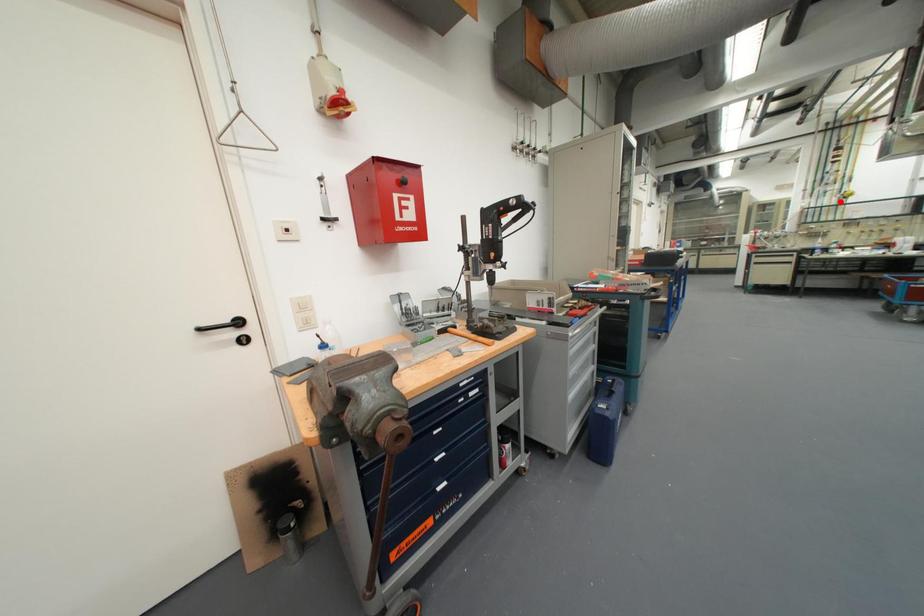
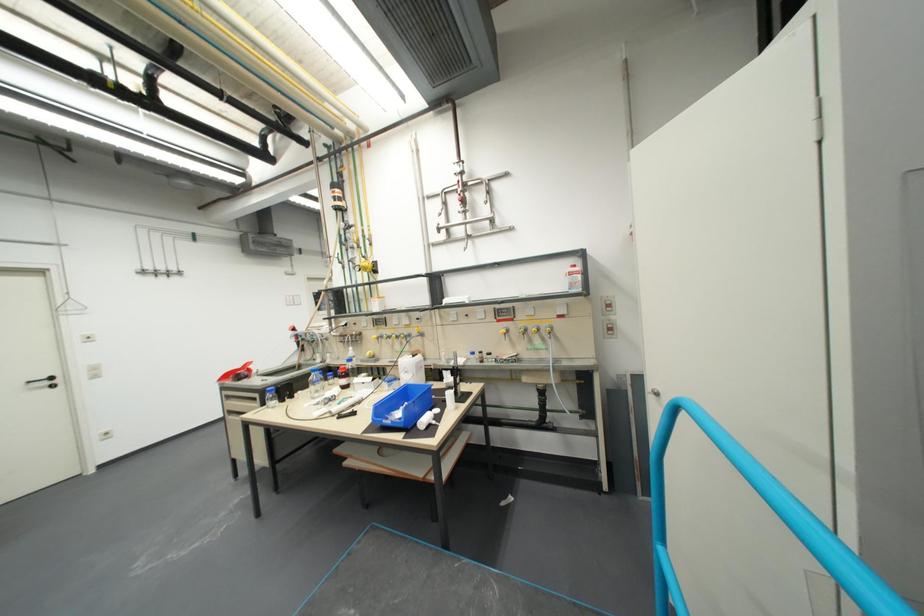
Find the pixel in the second image that matches the highlighted location in the first image.

(373, 278)